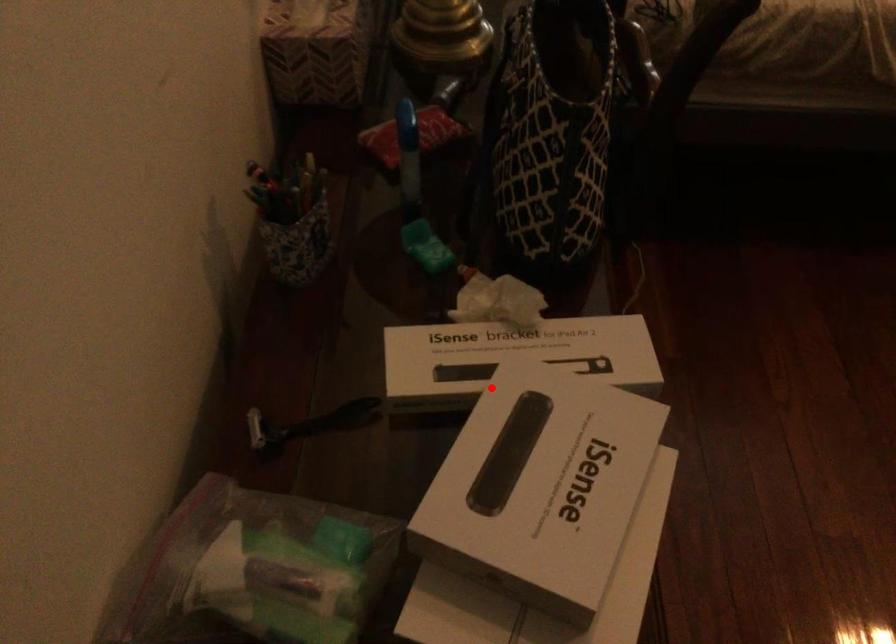
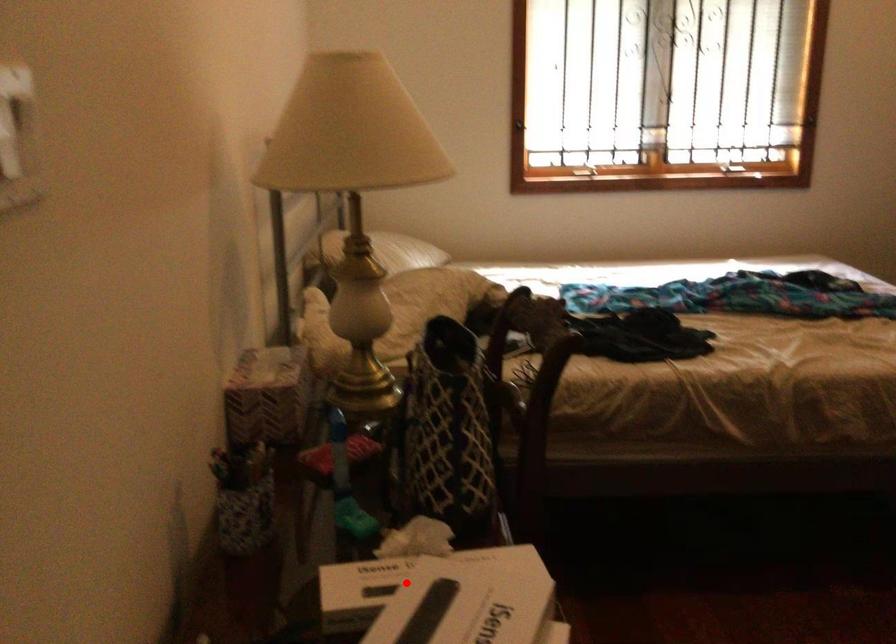
I am providing you with two images of the same scene from different viewpoints. A red point is marked on the first image and another point is marked on the second image. Does the point marked in image1 correspond to the same location as the one in image2?

Yes